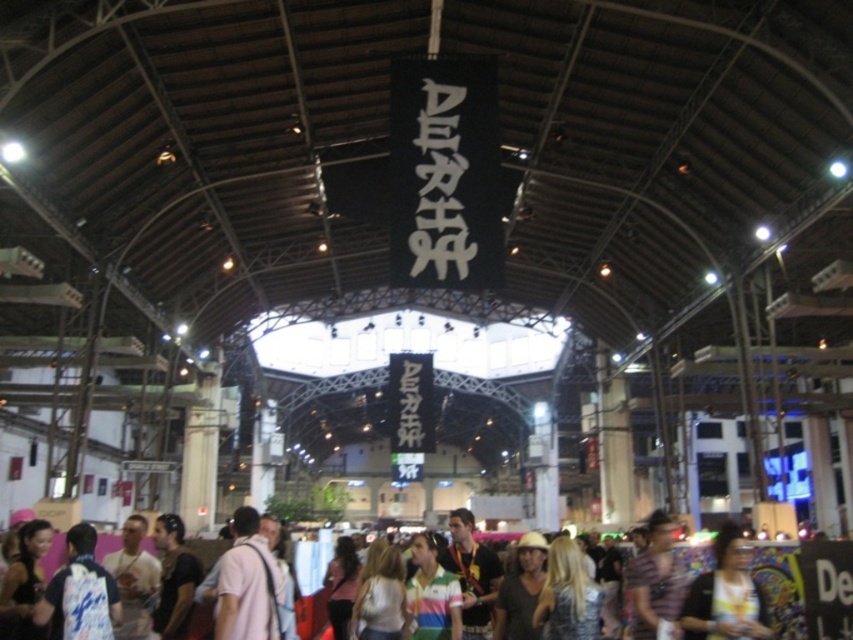
Question: Which of these objects is positioned farthest from the white t-shirt at center?

Choices:
 (A) pink fabric at center
 (B) matte black jacket at lower right

Answer: (B)

Question: Does pink fabric at center have a larger size compared to matte black jacket at lower right?

Choices:
 (A) yes
 (B) no

Answer: (B)

Question: Which object is the closest to the pink fabric at center?

Choices:
 (A) white t-shirt at center
 (B) matte black jacket at lower right

Answer: (A)

Question: Does pink fabric at center have a larger size compared to matte black jacket at lower right?

Choices:
 (A) no
 (B) yes

Answer: (A)

Question: Which object is positioned farthest from the white t-shirt at center?

Choices:
 (A) pink fabric at center
 (B) matte black jacket at lower right

Answer: (B)

Question: Is pink fabric at center above matte black jacket at lower right?

Choices:
 (A) yes
 (B) no

Answer: (A)